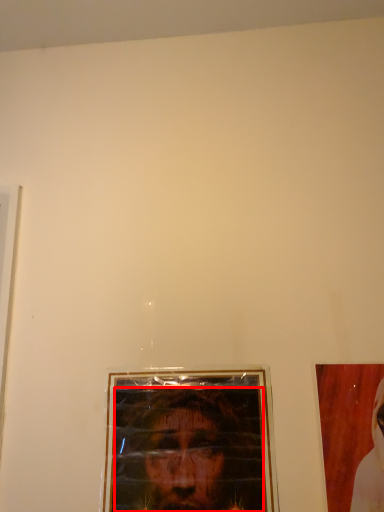
Question: Observing the image, what is the correct spatial positioning of man (annotated by the red box) in reference to picture frame?

Choices:
 (A) left
 (B) right

Answer: (A)